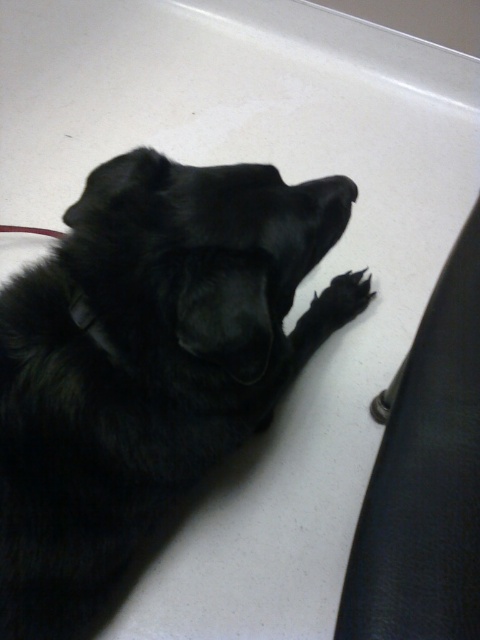
In the scene shown: Is black fluffy dog at center smaller than black fur paw at lower right?

Actually, black fluffy dog at center might be larger than black fur paw at lower right.

Is point (124, 460) behind point (365, 292)?

No, (124, 460) is in front of (365, 292).

Locate an element on the screen. The width and height of the screenshot is (480, 640). black fluffy dog at center is located at coordinates (143, 362).